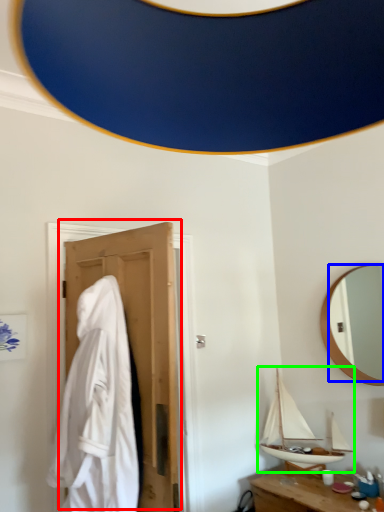
Question: Considering the real-world distances, which object is farthest from door (highlighted by a red box)? mirror (highlighted by a blue box) or boat (highlighted by a green box)?

Choices:
 (A) mirror
 (B) boat

Answer: (A)